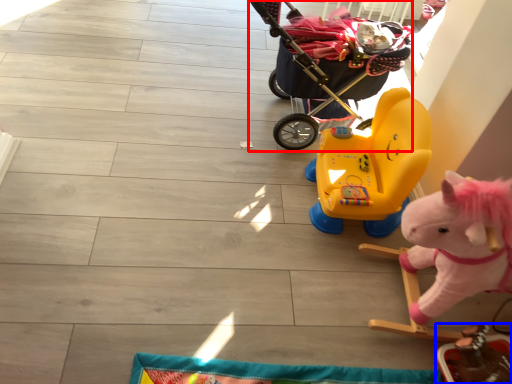
Question: Which point is closer to the camera, baby carriage (highlighted by a red box) or toy (highlighted by a blue box)?

Choices:
 (A) baby carriage
 (B) toy

Answer: (B)